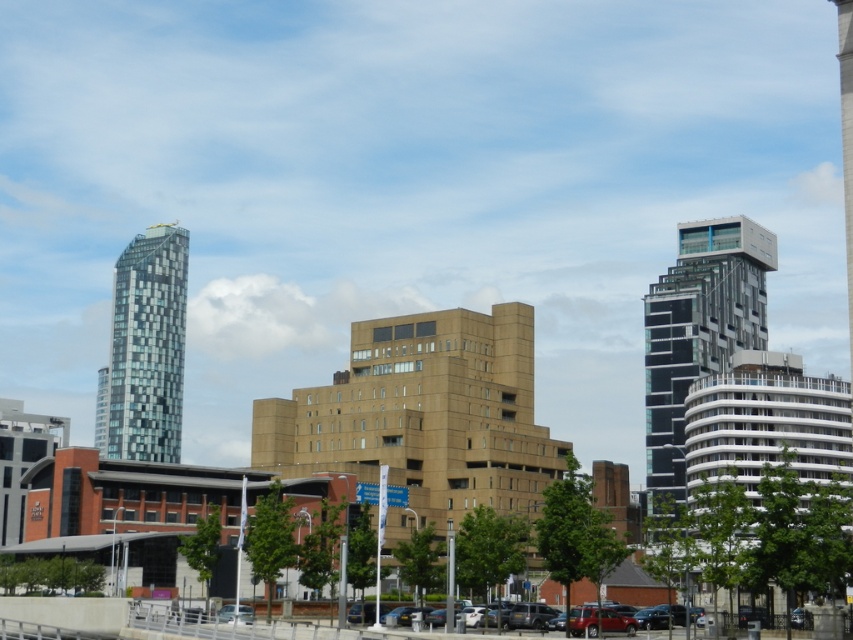
Does brown concrete building at center have a greater width compared to black glass tower at right?

Indeed, brown concrete building at center has a greater width compared to black glass tower at right.

Is brown concrete building at center shorter than black glass tower at right?

Indeed, brown concrete building at center has a lesser height compared to black glass tower at right.

The image size is (853, 640). Describe the element at coordinates (424, 413) in the screenshot. I see `brown concrete building at center` at that location.

Identify the location of brown concrete building at center. The width and height of the screenshot is (853, 640). (424, 413).

Looking at this image, who is more forward, (137, 250) or (645, 618)?

Point (645, 618) is more forward.

From the picture: Does glass mosaic tower at left appear under matte red car at lower center?

Incorrect, glass mosaic tower at left is not positioned below matte red car at lower center.

Which is in front, point (183, 310) or point (622, 612)?

Point (622, 612) is more forward.

What are the coordinates of `glass mosaic tower at left` in the screenshot? It's located at (144, 349).

Measure the distance between matte red car at lower center and metallic silver car at lower center.

The distance of matte red car at lower center from metallic silver car at lower center is 11.69 meters.

Find the location of a particular element. matte red car at lower center is located at coordinates (646, 616).

Which is in front, point (434, 624) or point (247, 620)?

Positioned in front is point (247, 620).

In order to click on matte red car at lower center in this screenshot , I will do `click(646, 616)`.